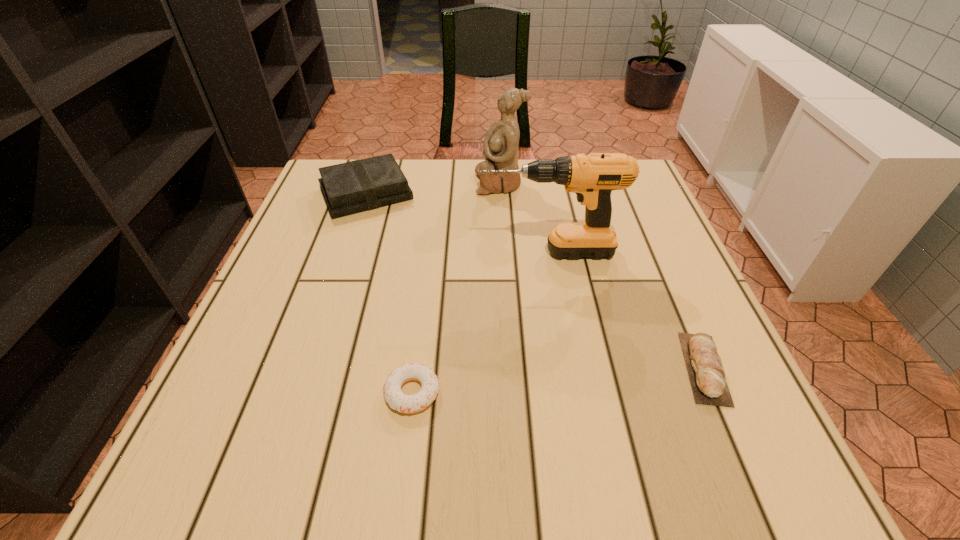
Locate an element on the screen. The height and width of the screenshot is (540, 960). figurine is located at coordinates (501, 142).

Identify the location of the third farthest object. This screenshot has width=960, height=540. (593, 177).

The height and width of the screenshot is (540, 960). I want to click on the leftmost object, so click(355, 186).

You are a GUI agent. You are given a task and a screenshot of the screen. Output one action in this format:
    pyautogui.click(x=<x>, y=<y>)
    Task: Click on the third tallest object
    The width and height of the screenshot is (960, 540).
    Given the screenshot: What is the action you would take?
    pyautogui.click(x=355, y=186)

The width and height of the screenshot is (960, 540). I want to click on the second shortest object, so click(707, 376).

At what (x,y) coordinates should I click in order to perform the action: click on pita bread. Please return your answer as a coordinate pair (x, y). This screenshot has width=960, height=540. Looking at the image, I should click on (707, 376).

Where is `the second object from left to right`? the second object from left to right is located at coordinates (397, 400).

I want to click on the shortest object, so click(397, 400).

Identify the location of vacant point located on the front-facing side of the figurine. The width and height of the screenshot is (960, 540). (434, 183).

This screenshot has width=960, height=540. I want to click on free spot located on the front-facing side of the figurine, so click(374, 183).